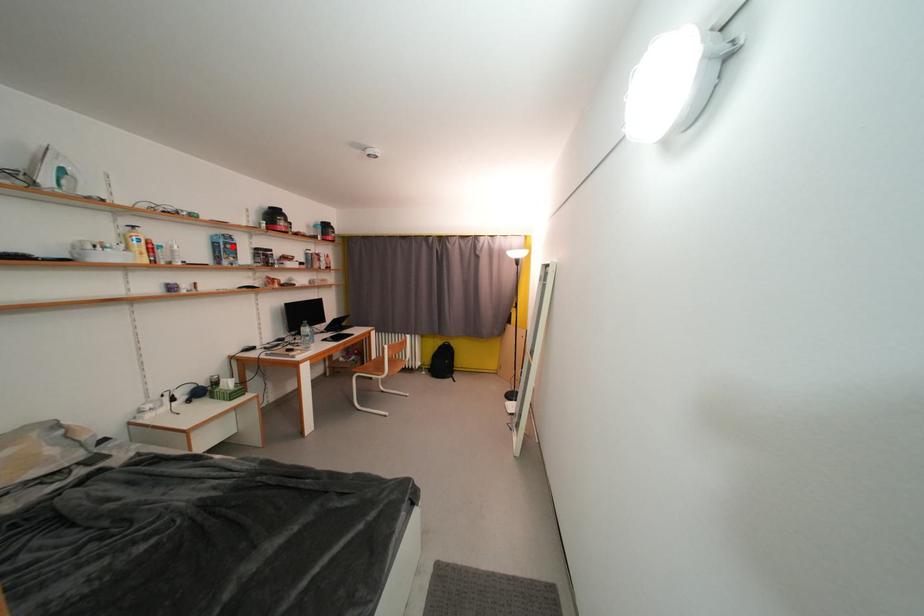
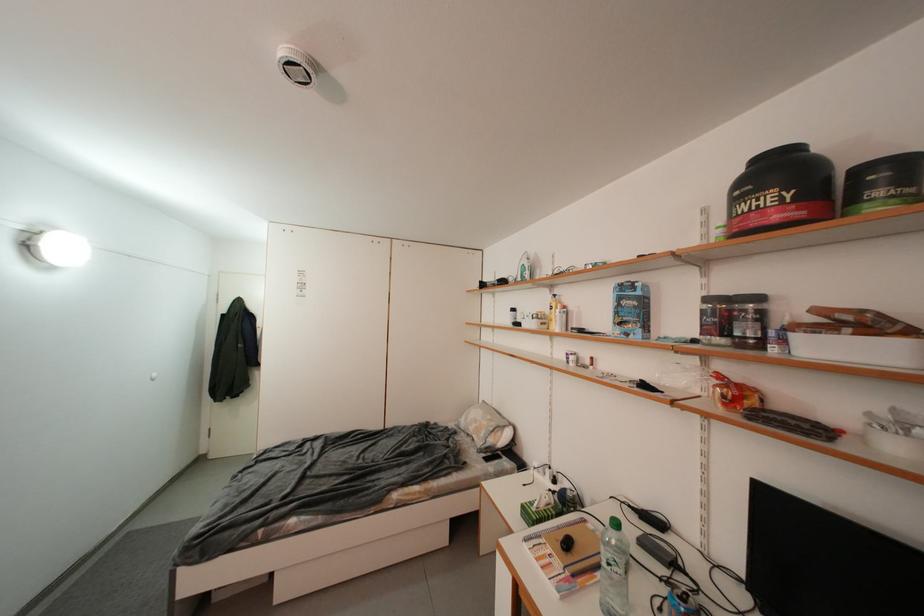
Find the pixel in the second image that matches the highlighted location in the first image.

(627, 302)